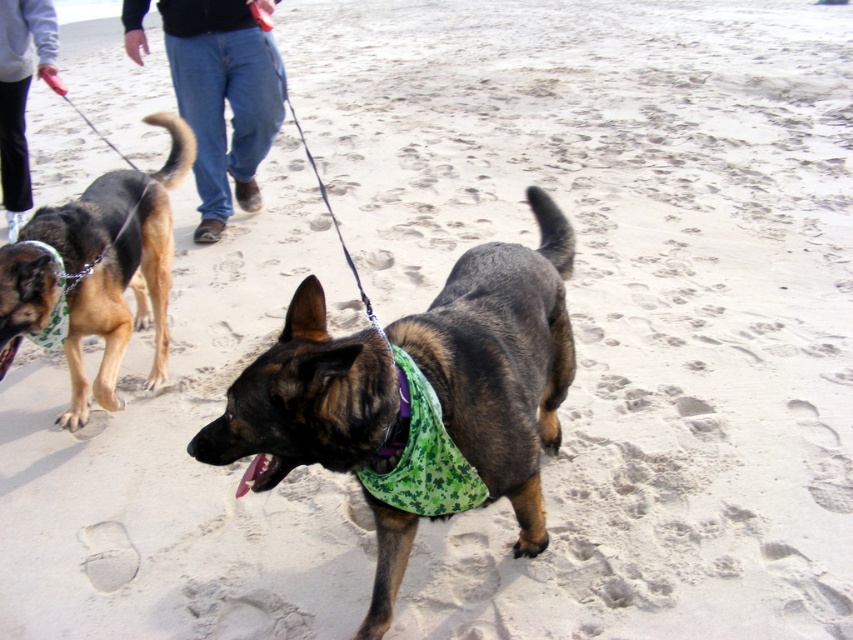
In the scene shown: Who is shorter, jeans at center or green fabric bandana at center?

Standing shorter between the two is green fabric bandana at center.

Can you confirm if jeans at center is smaller than green fabric bandana at center?

No.

Where is `jeans at center`? The width and height of the screenshot is (853, 640). jeans at center is located at coordinates (223, 97).

Can you confirm if brown fur dog at left is taller than brown fur dog at center?

Yes, brown fur dog at left is taller than brown fur dog at center.

Is brown fur dog at left thinner than brown fur dog at center?

Yes.

Between point (102, 202) and point (283, 342), which one is positioned behind?

The point (102, 202) is more distant.

The height and width of the screenshot is (640, 853). I want to click on brown fur dog at left, so click(x=96, y=273).

Is point (564, 316) farther from camera compared to point (459, 500)?

Yes, it is behind point (459, 500).

Between brown fur dog at center and green fabric bandana at center, which one is positioned lower?

Positioned lower is green fabric bandana at center.

Find the location of a particular element. The image size is (853, 640). brown fur dog at center is located at coordinates (294, 396).

Image resolution: width=853 pixels, height=640 pixels. What are the coordinates of `brown fur dog at center` in the screenshot? It's located at (294, 396).